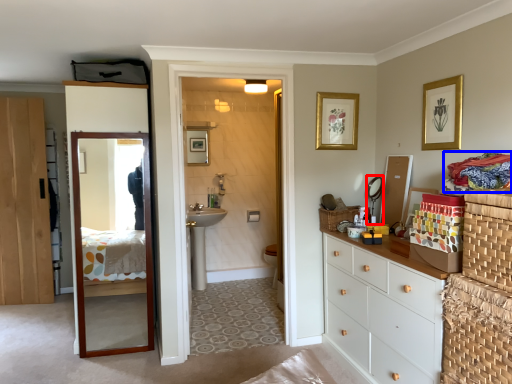
Question: Which object appears farthest to the camera in this image, mirror (highlighted by a red box) or laundry (highlighted by a blue box)?

Choices:
 (A) mirror
 (B) laundry

Answer: (A)